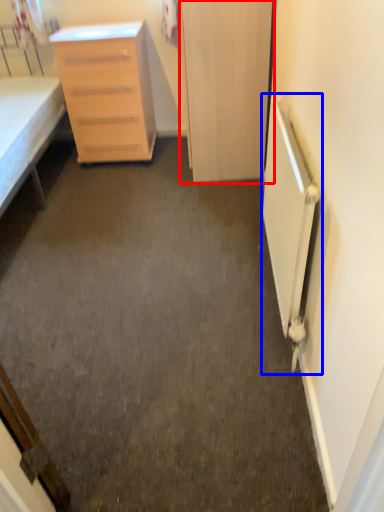
Question: Which of the following is the farthest to the observer, door (highlighted by a red box) or radiator (highlighted by a blue box)?

Choices:
 (A) door
 (B) radiator

Answer: (A)